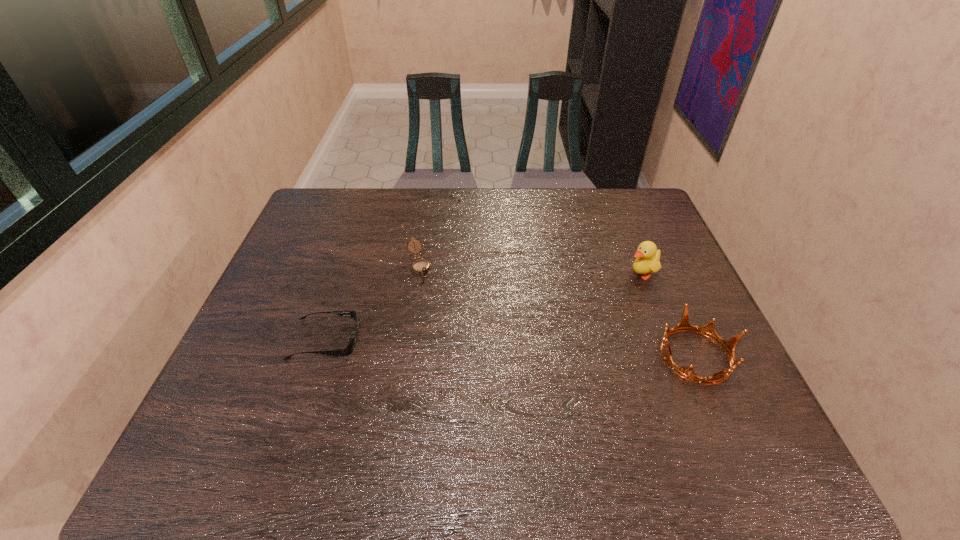
Where is `vacant space in between the crown and the compass`? vacant space in between the crown and the compass is located at coordinates (557, 311).

At what (x,y) coordinates should I click in order to perform the action: click on unoccupied area between the crown and the tallest object. Please return your answer as a coordinate pair (x, y). The image size is (960, 540). Looking at the image, I should click on (668, 314).

The image size is (960, 540). I want to click on empty space that is in between the leftmost object and the crown, so coord(511,348).

Where is `free spot between the tallest object and the crown`? This screenshot has width=960, height=540. free spot between the tallest object and the crown is located at coordinates (668, 314).

The image size is (960, 540). I want to click on blank region between the leftmost object and the crown, so click(511, 348).

Where is `vacant area that lies between the leftmost object and the second tallest object`? vacant area that lies between the leftmost object and the second tallest object is located at coordinates (511, 348).

Locate an element on the screen. This screenshot has height=540, width=960. object that is the closest one to the leftmost object is located at coordinates (420, 266).

At what (x,y) coordinates should I click in order to perform the action: click on object that stands as the closest to the tallest object. Please return your answer as a coordinate pair (x, y). The image size is (960, 540). Looking at the image, I should click on (708, 330).